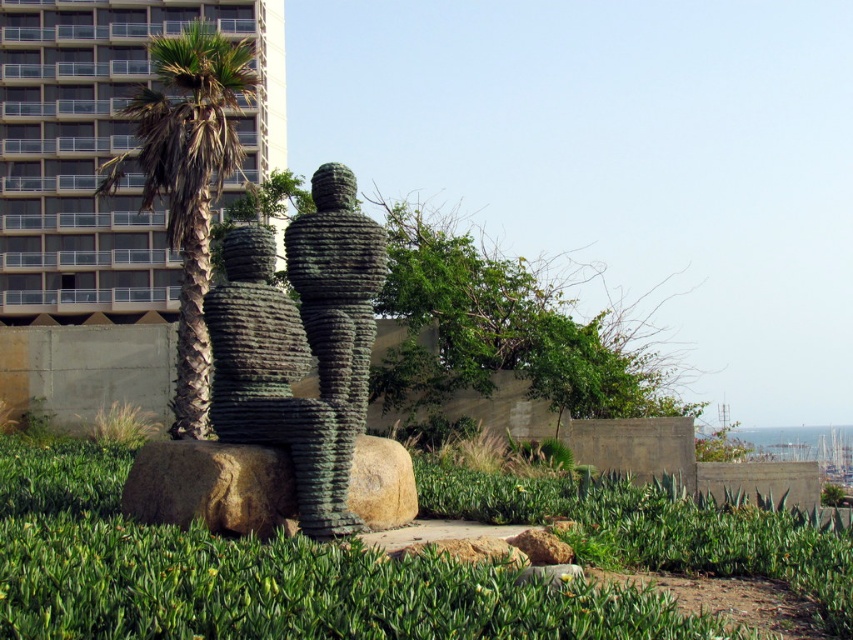
Who is lower down, gray concrete building at upper left or green textured palm tree at left?

green textured palm tree at left is lower down.

Which of these two, gray concrete building at upper left or green textured palm tree at left, stands shorter?

Standing shorter between the two is green textured palm tree at left.

Does point (265, 12) come farther from viewer compared to point (241, 81)?

That is True.

At what (x,y) coordinates should I click in order to perform the action: click on gray concrete building at upper left. Please return your answer as a coordinate pair (x, y). The height and width of the screenshot is (640, 853). Looking at the image, I should click on (103, 152).

Consider the image. Is gray concrete building at upper left below green textured stone sculpture at center?

No.

Who is taller, gray concrete building at upper left or green textured stone sculpture at center?

Standing taller between the two is gray concrete building at upper left.

At what (x,y) coordinates should I click in order to perform the action: click on gray concrete building at upper left. Please return your answer as a coordinate pair (x, y). Image resolution: width=853 pixels, height=640 pixels. Looking at the image, I should click on (103, 152).

At what (x,y) coordinates should I click in order to perform the action: click on gray concrete building at upper left. Please return your answer as a coordinate pair (x, y). This screenshot has width=853, height=640. Looking at the image, I should click on (103, 152).

Can you confirm if green leafy grass at center is smaller than green textured stone sculpture at center?

Actually, green leafy grass at center might be larger than green textured stone sculpture at center.

Which is above, green leafy grass at center or green textured stone sculpture at center?

green textured stone sculpture at center is higher up.

Does point (102, 472) come farther from viewer compared to point (312, 492)?

That is True.

I want to click on green leafy grass at center, so click(x=248, y=573).